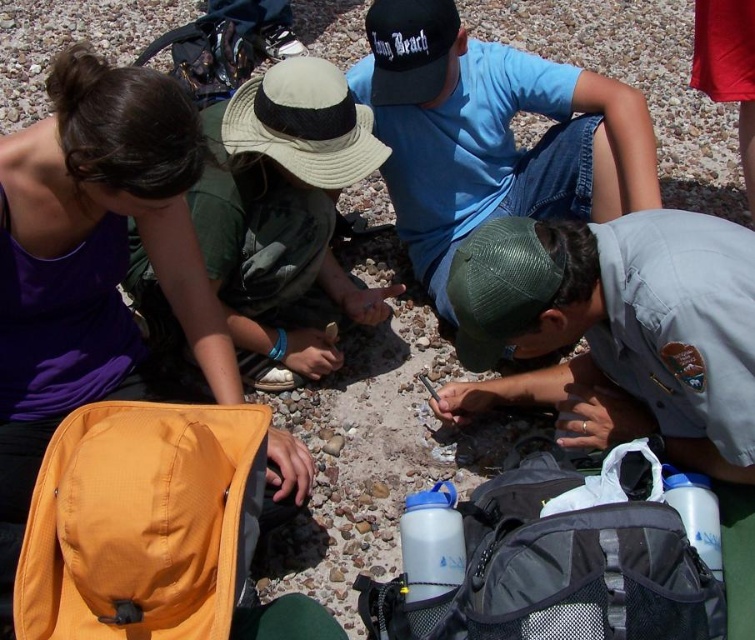
Question: Does tan fabric baseball hat at center come behind green mesh baseball cap at center?

Choices:
 (A) yes
 (B) no

Answer: (A)

Question: Is green mesh cap at lower center closer to the viewer compared to black fabric baseball cap at upper center?

Choices:
 (A) no
 (B) yes

Answer: (B)

Question: Which point is closer to the camera?

Choices:
 (A) (427, 76)
 (B) (670, 276)

Answer: (B)

Question: Which object is positioned closest to the tan fabric baseball hat at center?

Choices:
 (A) green mesh cap at lower center
 (B) green mesh baseball cap at center

Answer: (B)

Question: Which point is closer to the camera?

Choices:
 (A) (421, 97)
 (B) (652, 310)

Answer: (B)

Question: Does blue cotton shirt at upper center come in front of black fabric baseball cap at upper center?

Choices:
 (A) no
 (B) yes

Answer: (B)